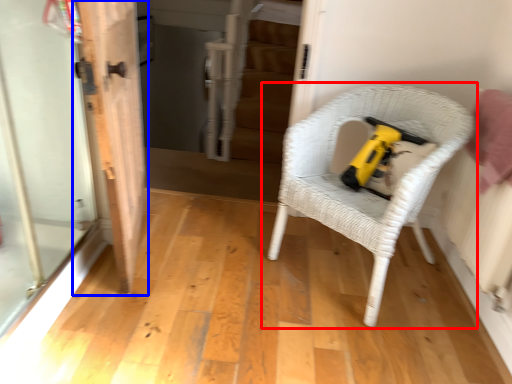
Question: Which object is further to the camera taking this photo, chair (highlighted by a red box) or door (highlighted by a blue box)?

Choices:
 (A) chair
 (B) door

Answer: (A)